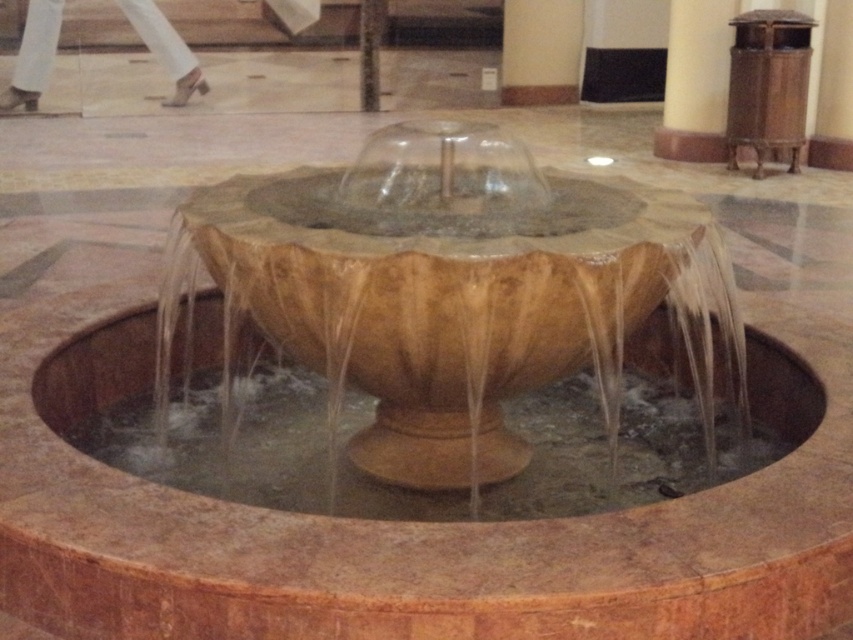
Question: Which object is farther from the camera taking this photo?

Choices:
 (A) translucent water at center
 (B) smooth stone pillar at center
 (C) smooth beige pillar at upper center
 (D) brown stone fountain at center

Answer: (C)

Question: Does brown stone fountain at center have a larger size compared to smooth beige pillar at upper center?

Choices:
 (A) no
 (B) yes

Answer: (B)

Question: Is translucent water at center smaller than smooth beige pillar at upper center?

Choices:
 (A) no
 (B) yes

Answer: (A)

Question: Does translucent water at center appear on the right side of smooth stone pillar at center?

Choices:
 (A) yes
 (B) no

Answer: (A)

Question: Which point is closer to the camera?

Choices:
 (A) (670, 419)
 (B) (502, 77)
 (C) (178, 275)
 (D) (380, 36)

Answer: (C)

Question: Estimate the real-world distances between objects in this image. Which object is farther from the translucent water at center?

Choices:
 (A) smooth beige pillar at upper center
 (B) smooth stone pillar at center

Answer: (A)